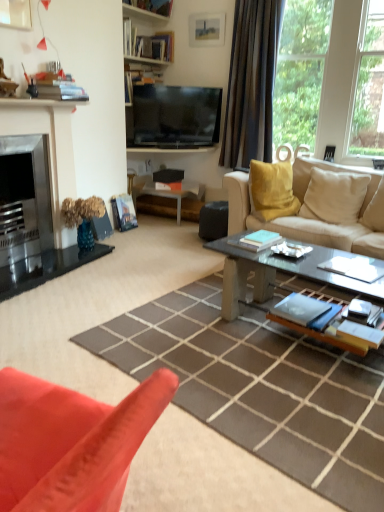
Question: Does point (31, 180) appear closer or farther from the camera than point (195, 202)?

Choices:
 (A) farther
 (B) closer

Answer: (B)

Question: Is brushed metal fireplace at left wider or thinner than white glossy side table at center?

Choices:
 (A) thin
 (B) wide

Answer: (A)

Question: Based on their relative distances, which object is nearer to the beige fabric pillow at right?

Choices:
 (A) wooden bookshelf at upper center
 (B) flat screen tv at center
 (C) beige fabric couch at center
 (D) white glossy side table at center
 (E) matte white picture frame at upper center

Answer: (C)

Question: Which is nearer to the beige fabric pillow at right?

Choices:
 (A) matte white picture frame at upper center
 (B) glass concrete coffee table at center
 (C) flat screen tv at center
 (D) wooden bookshelf at upper center
 (E) beige fabric couch at center

Answer: (E)